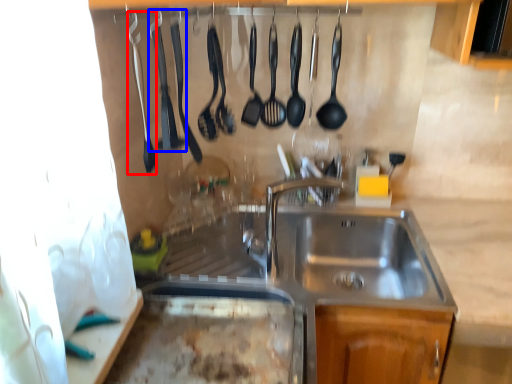
Question: Which object appears closest to the camera in this image, silverware (highlighted by a red box) or silverware (highlighted by a blue box)?

Choices:
 (A) silverware
 (B) silverware

Answer: (A)